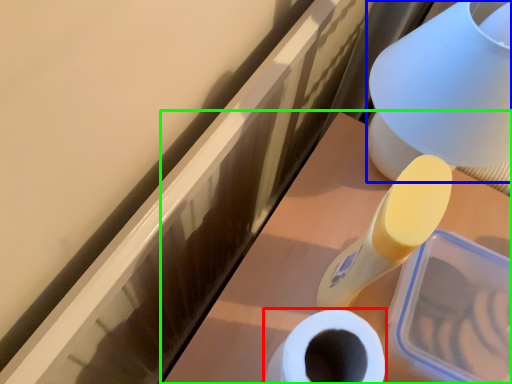
Question: Estimate the real-world distances between objects in this image. Which object is farther from toilet paper (highlighted by a red box), table lamp (highlighted by a blue box) or vanity (highlighted by a green box)?

Choices:
 (A) table lamp
 (B) vanity

Answer: (A)